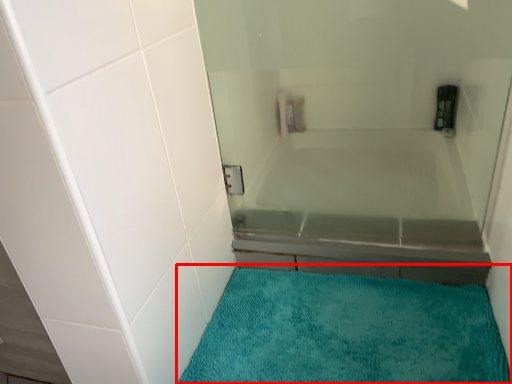
Question: Observing the image, what is the correct spatial positioning of bath mat (annotated by the red box) in reference to bath?

Choices:
 (A) right
 (B) left

Answer: (B)